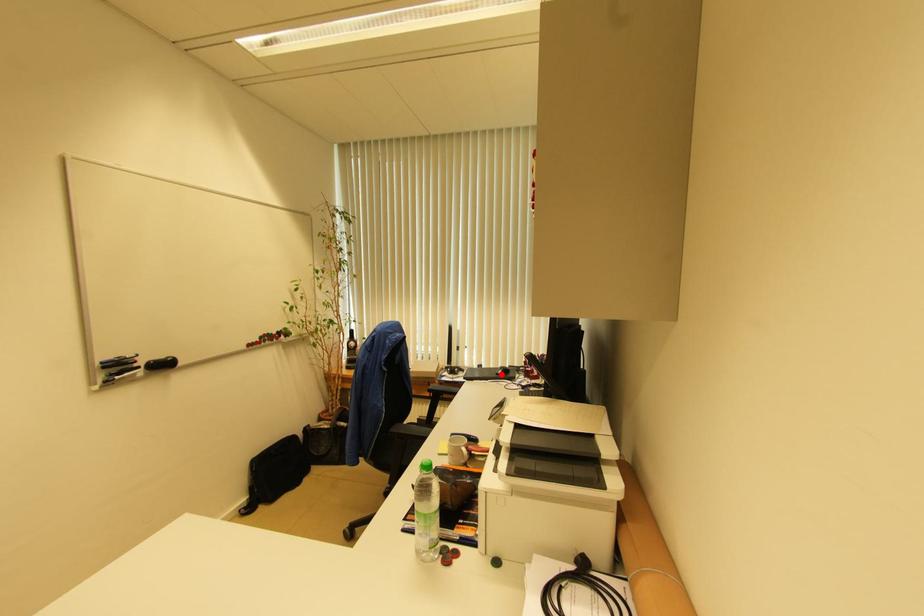
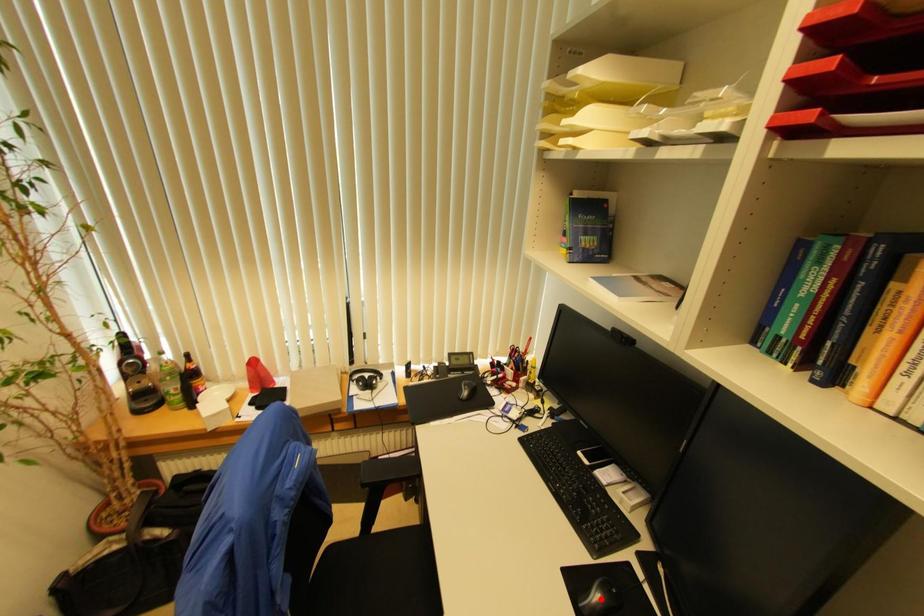
I am providing you with two images of the same scene from different viewpoints. A red point is marked on the first image and another point is marked on the second image. Do the highlighted points in image1 and image2 indicate the same real-world spot?

No